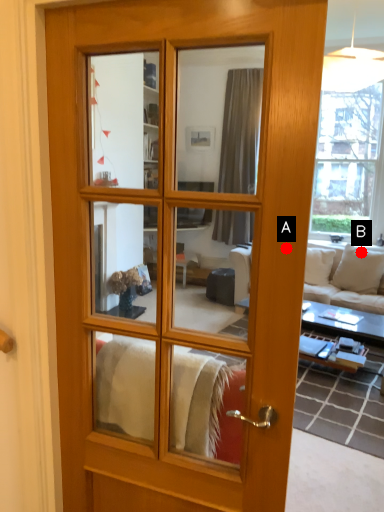
Question: Two points are circled on the image, labeled by A and B beside each circle. Which point is closer to the camera?

Choices:
 (A) A is closer
 (B) B is closer

Answer: (A)